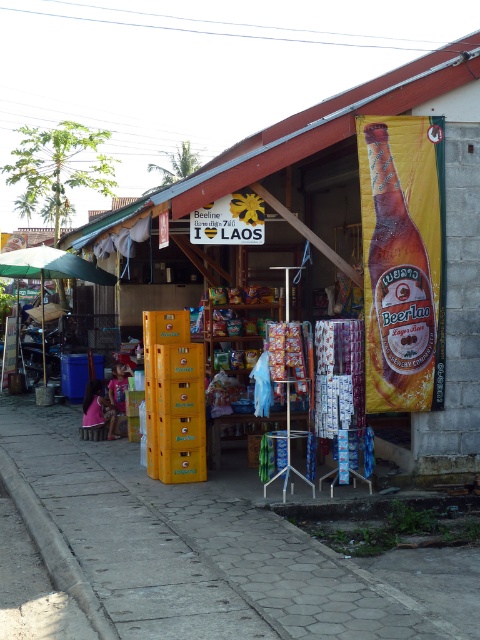
Is yellow plastic crates at center shorter than smooth concrete pavement at center?

No.

Does yellow plastic crates at center have a lesser width compared to smooth concrete pavement at center?

Indeed, yellow plastic crates at center has a lesser width compared to smooth concrete pavement at center.

Does point (364, 403) lie in front of point (324, 632)?

No, it is not.

Image resolution: width=480 pixels, height=640 pixels. I want to click on yellow plastic crates at center, so click(369, 237).

Is point (203, 588) more distant than point (103, 616)?

That is True.

Who is higher up, smooth concrete pavement at center or gray concrete curb at lower left?

gray concrete curb at lower left is higher up.

Does point (95, 444) come behind point (81, 570)?

Yes.

I want to click on smooth concrete pavement at center, so click(x=222, y=552).

Looking at this image, is yellow plastic crates at center taller than golden glass beer bottle at right?

No, yellow plastic crates at center is not taller than golden glass beer bottle at right.

Does yellow plastic crates at center appear on the right side of golden glass beer bottle at right?

Incorrect, yellow plastic crates at center is not on the right side of golden glass beer bottle at right.

Which is behind, point (476, 237) or point (367, 298)?

The point (476, 237) is behind.

I want to click on yellow plastic crates at center, so click(369, 237).